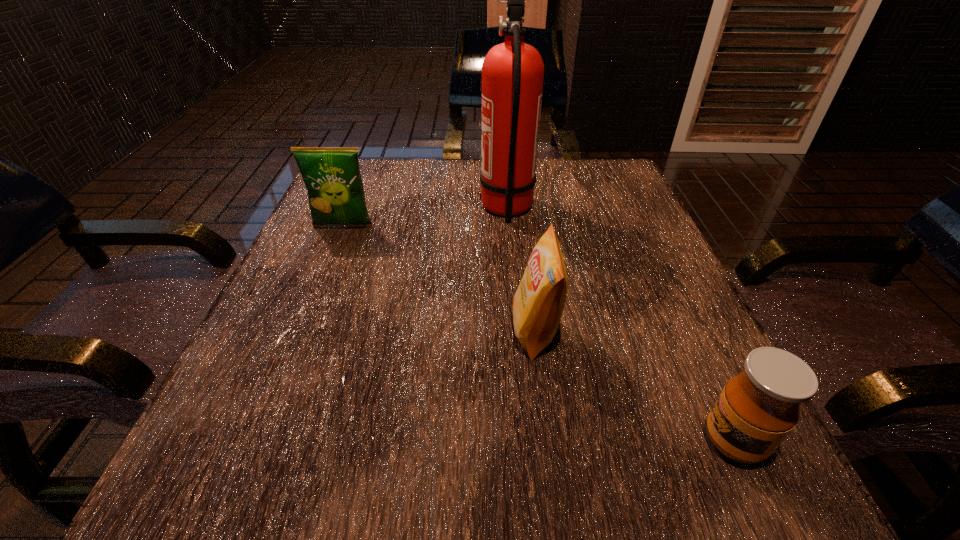
Find the location of a particular element. vacant region located on the front-facing side of the farther crisp (potato chip) is located at coordinates (323, 276).

Find the location of a particular element. This screenshot has width=960, height=540. vacant space situated on the front-facing side of the nearer crisp (potato chip) is located at coordinates (450, 331).

The height and width of the screenshot is (540, 960). Find the location of `vacant space located on the front-facing side of the nearer crisp (potato chip)`. vacant space located on the front-facing side of the nearer crisp (potato chip) is located at coordinates (313, 331).

Identify the location of vacant space situated 0.340m on the front-facing side of the nearer crisp (potato chip). (301, 331).

I want to click on vacant position located on the front-facing side of the rightmost object, so click(x=571, y=441).

Locate an element on the screen. This screenshot has width=960, height=540. vacant space located 0.370m on the front-facing side of the rightmost object is located at coordinates (416, 441).

I want to click on free spot located on the front-facing side of the rightmost object, so coord(431,441).

Image resolution: width=960 pixels, height=540 pixels. In order to click on object located in the far edge section of the desktop in this screenshot , I will do `click(512, 72)`.

What are the coordinates of `object located at the near edge` in the screenshot? It's located at (757, 409).

Image resolution: width=960 pixels, height=540 pixels. Identify the location of object that is at the left edge. (332, 177).